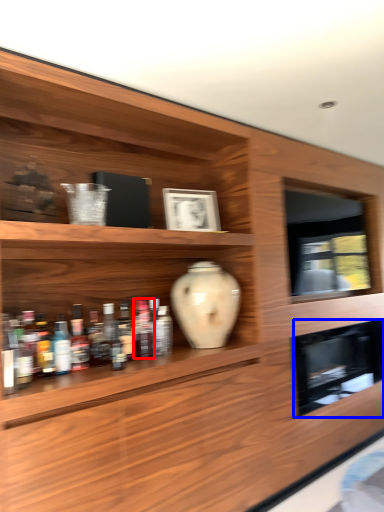
Question: Among these objects, which one is nearest to the camera, bottle (highlighted by a red box) or cabinet (highlighted by a blue box)?

Choices:
 (A) bottle
 (B) cabinet

Answer: (A)